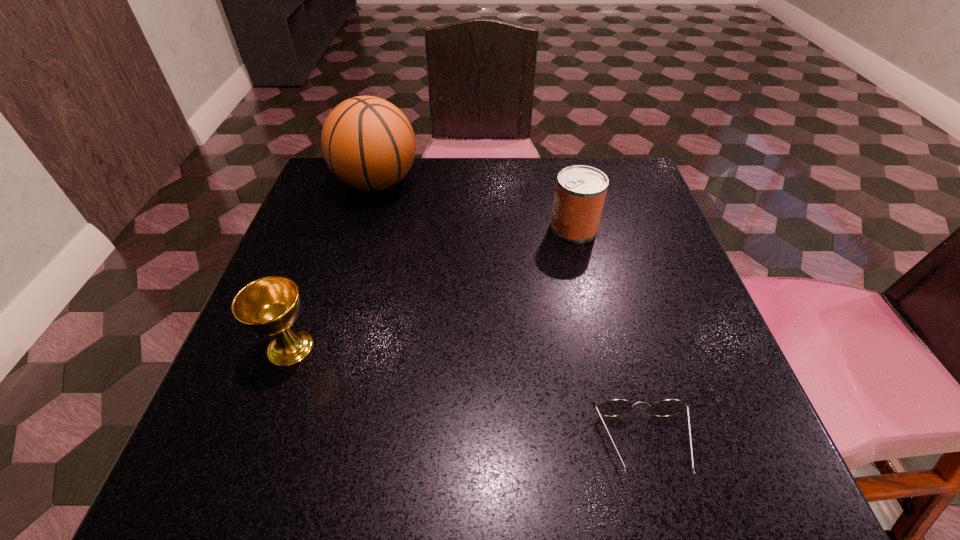
At what (x,y) coordinates should I click in order to perform the action: click on free point between the second farthest object and the shortest object. Please return your answer as a coordinate pair (x, y). Image resolution: width=960 pixels, height=540 pixels. Looking at the image, I should click on (609, 336).

This screenshot has width=960, height=540. Identify the location of free space between the second farthest object and the spectacles. (609, 336).

This screenshot has height=540, width=960. In order to click on free area in between the third nearest object and the nearest object in this screenshot , I will do `click(609, 336)`.

Identify the location of empty space between the second farthest object and the nearest object. This screenshot has height=540, width=960. (609, 336).

Identify the location of vacant space that is in between the shortest object and the third nearest object. The image size is (960, 540). (609, 336).

Point out which object is positioned as the second nearest to the shortest object. Please provide its 2D coordinates. Your answer should be formatted as a tuple, i.e. [(x, y)], where the tuple contains the x and y coordinates of a point satisfying the conditions above.

[(268, 306)]

Identify the location of the third closest object to the farthest object. (615, 407).

Find the location of `vacant space that satisfies the following two spatial constraints: 1. on the back side of the basketball; 2. on the right side of the second nearest object`. vacant space that satisfies the following two spatial constraints: 1. on the back side of the basketball; 2. on the right side of the second nearest object is located at coordinates (349, 182).

At what (x,y) coordinates should I click in order to perform the action: click on vacant region that satisfies the following two spatial constraints: 1. on the back side of the third nearest object; 2. on the right side of the chalice. Please return your answer as a coordinate pair (x, y). Looking at the image, I should click on coord(333,227).